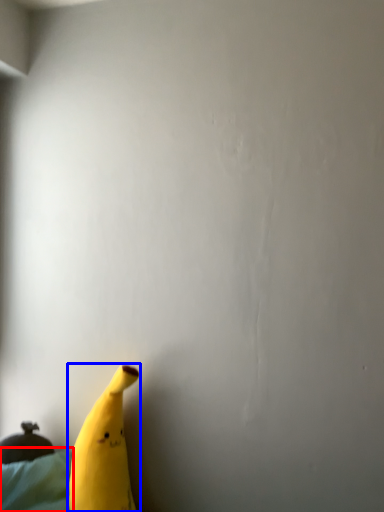
Question: Which point is further to the camera, sheet (highlighted by a red box) or banana (highlighted by a blue box)?

Choices:
 (A) sheet
 (B) banana

Answer: (A)